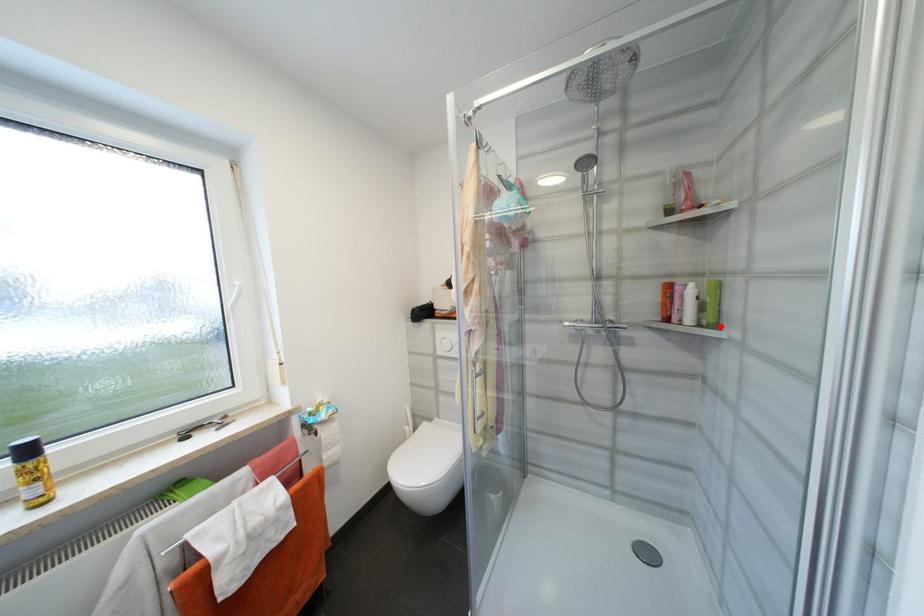
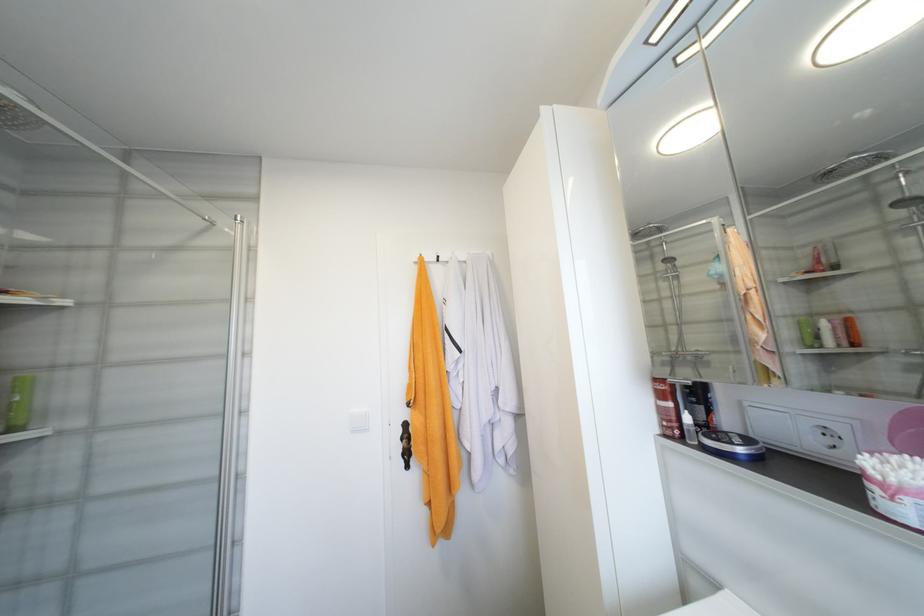
Find the pixel in the second image that matches the highlighted location in the first image.

(19, 430)